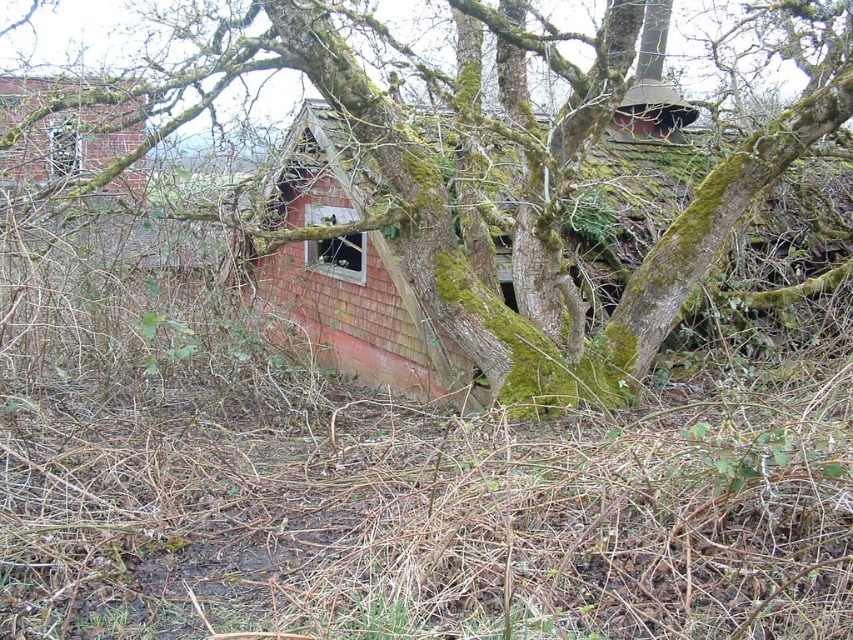
Consider the image. You are a bird looking for a nesting spot. You see the green mossy tree at center and the red shingled hut at center. Which location would provide a higher nesting spot?

The green mossy tree at center is taller than the red shingled hut at center, so the green mossy tree at center would provide a higher nesting spot.

You are standing at the point with coordinates (x=520, y=186) in the image. What object is located exactly at this point?

The green mossy tree at center is located exactly at the point with coordinates (x=520, y=186).